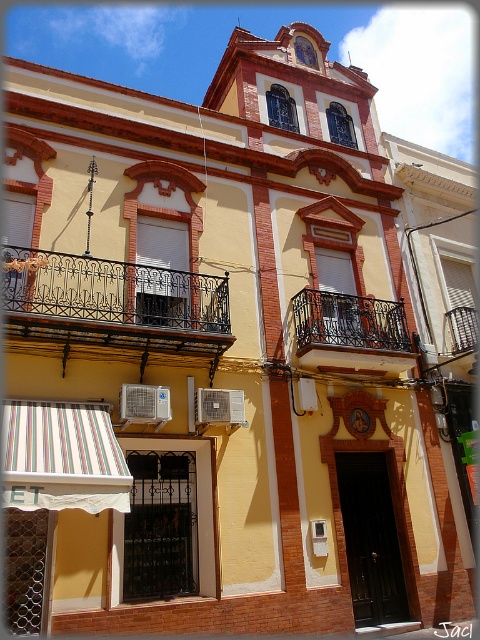
You are an architect reviewing the building design. You need to determine if the black wrought iron balcony at upper left can support a larger sculpture compared to the black wrought iron balcony at center. Based on their height, which balcony might be more suitable for a taller sculpture?

The black wrought iron balcony at upper left is much taller than the black wrought iron balcony at center, so it can support a larger sculpture.